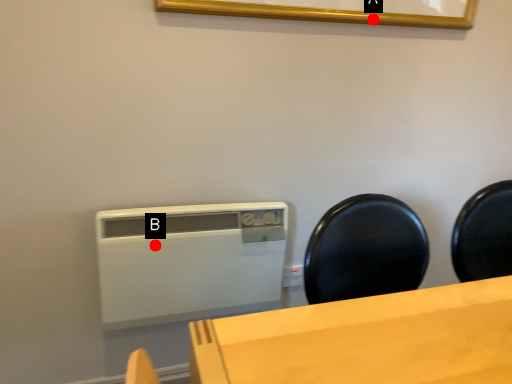
Question: Two points are circled on the image, labeled by A and B beside each circle. Which point appears closest to the camera in this image?

Choices:
 (A) A is closer
 (B) B is closer

Answer: (B)